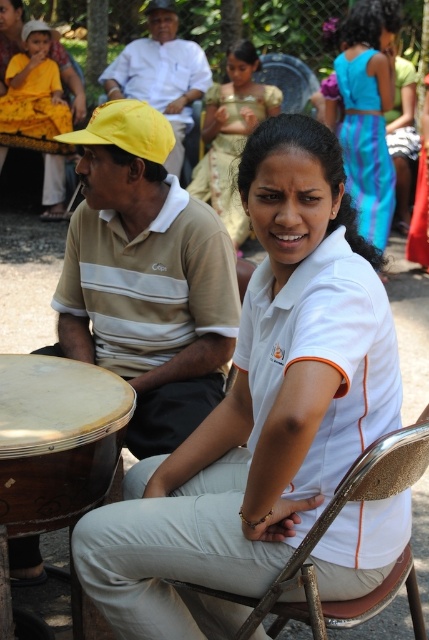
Is white matte shirt at center smaller than yellow fabric dress at upper left?

Incorrect, white matte shirt at center is not smaller in size than yellow fabric dress at upper left.

Does white matte shirt at center have a greater width compared to yellow fabric dress at upper left?

Yes, white matte shirt at center is wider than yellow fabric dress at upper left.

Locate an element on the screen. The height and width of the screenshot is (640, 429). white matte shirt at center is located at coordinates (259, 410).

Which is more to the left, white matte shirt at center or matte yellow cap at left?

Positioned to the left is matte yellow cap at left.

Is point (301, 474) closer to camera compared to point (229, 310)?

Yes, point (301, 474) is in front of point (229, 310).

Identify the location of white matte shirt at center. This screenshot has width=429, height=640. (259, 410).

Find the location of `matte yellow cap at left`. matte yellow cap at left is located at coordinates (147, 278).

Consider the image. Is matte yellow cap at left positioned in front of yellow fabric dress at upper left?

Yes, matte yellow cap at left is closer to the viewer.

Locate an element on the screen. The image size is (429, 640). matte yellow cap at left is located at coordinates (147, 278).

You are a GUI agent. You are given a task and a screenshot of the screen. Output one action in this format:
    pyautogui.click(x=<x>, y=<y>)
    Task: Click on the matte yellow cap at left
    The image size is (429, 640).
    Given the screenshot: What is the action you would take?
    pyautogui.click(x=147, y=278)